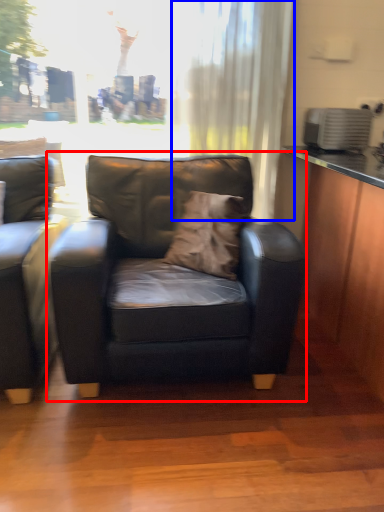
Question: Which object appears farthest to the camera in this image, chair (highlighted by a red box) or curtain (highlighted by a blue box)?

Choices:
 (A) chair
 (B) curtain

Answer: (B)